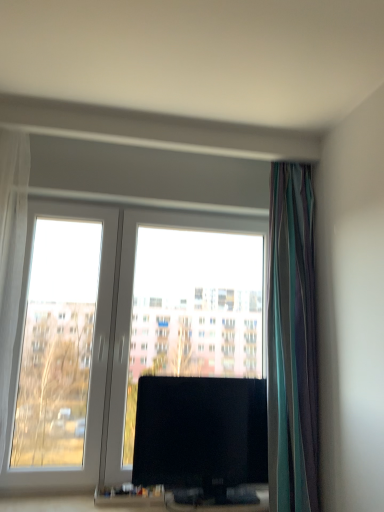
Question: Can you confirm if white sheer curtain at left, which is the 2th curtain from right to left, is taller than striped fabric curtain at right, marked as the 2th curtain in a left-to-right arrangement?

Choices:
 (A) yes
 (B) no

Answer: (B)

Question: Is white sheer curtain at left, which is the 1th curtain in left-to-right order, smaller than striped fabric curtain at right, the 1th curtain when ordered from right to left?

Choices:
 (A) no
 (B) yes

Answer: (B)

Question: Can you see white sheer curtain at left, which is the 1th curtain in left-to-right order, touching striped fabric curtain at right, marked as the 2th curtain in a left-to-right arrangement?

Choices:
 (A) no
 (B) yes

Answer: (A)

Question: Does white sheer curtain at left, which is the 1th curtain in left-to-right order, come in front of striped fabric curtain at right, the 1th curtain when ordered from right to left?

Choices:
 (A) yes
 (B) no

Answer: (A)

Question: Is white sheer curtain at left, which is the 1th curtain in left-to-right order, not inside striped fabric curtain at right, the 1th curtain when ordered from right to left?

Choices:
 (A) yes
 (B) no

Answer: (A)

Question: Is point (269, 342) positioned closer to the camera than point (39, 214)?

Choices:
 (A) farther
 (B) closer

Answer: (B)

Question: Relative to transparent glass window at center, is striped fabric curtain at right, the 1th curtain when ordered from right to left, in front or behind?

Choices:
 (A) behind
 (B) front

Answer: (B)

Question: Looking at their shapes, would you say striped fabric curtain at right, the 1th curtain when ordered from right to left, is wider or thinner than transparent glass window at center?

Choices:
 (A) wide
 (B) thin

Answer: (A)

Question: Based on their positions, is striped fabric curtain at right, the 1th curtain when ordered from right to left, located to the left or right of transparent glass window at center?

Choices:
 (A) right
 (B) left

Answer: (A)

Question: Is striped fabric curtain at right, the 1th curtain when ordered from right to left, situated inside black glossy tv at center or outside?

Choices:
 (A) outside
 (B) inside

Answer: (A)

Question: Is point (306, 337) positioned closer to the camera than point (145, 452)?

Choices:
 (A) closer
 (B) farther

Answer: (A)

Question: Is striped fabric curtain at right, marked as the 2th curtain in a left-to-right arrangement, taller or shorter than black glossy tv at center?

Choices:
 (A) short
 (B) tall

Answer: (B)

Question: Considering the positions of striped fabric curtain at right, marked as the 2th curtain in a left-to-right arrangement, and black glossy tv at center in the image, is striped fabric curtain at right, marked as the 2th curtain in a left-to-right arrangement, bigger or smaller than black glossy tv at center?

Choices:
 (A) big
 (B) small

Answer: (A)

Question: In terms of size, does white sheer curtain at left, which is the 1th curtain in left-to-right order, appear bigger or smaller than striped fabric curtain at right, marked as the 2th curtain in a left-to-right arrangement?

Choices:
 (A) big
 (B) small

Answer: (B)

Question: Is white sheer curtain at left, which is the 2th curtain from right to left, inside the boundaries of striped fabric curtain at right, the 1th curtain when ordered from right to left, or outside?

Choices:
 (A) inside
 (B) outside

Answer: (B)